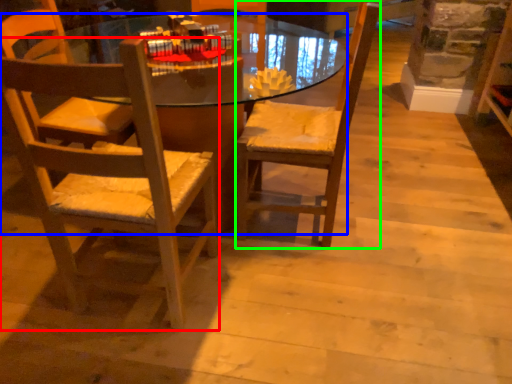
Question: Which is nearer to the chair (highlighted by a red box)? desk (highlighted by a blue box) or chair (highlighted by a green box).

Choices:
 (A) desk
 (B) chair

Answer: (B)